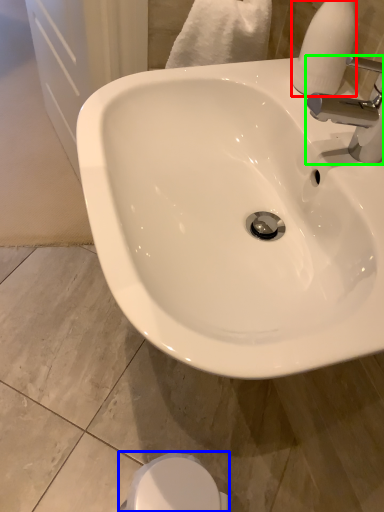
Question: Based on their relative distances, which object is nearer to soap dispenser (highlighted by a red box)? Choose from bidet (highlighted by a blue box) and tap (highlighted by a green box).

Choices:
 (A) bidet
 (B) tap

Answer: (B)